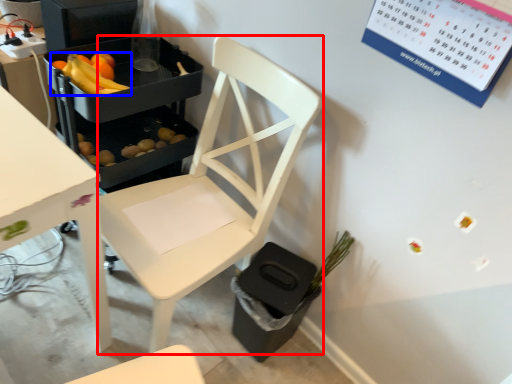
Question: Which object is further to the camera taking this photo, chair (highlighted by a red box) or banana (highlighted by a blue box)?

Choices:
 (A) chair
 (B) banana

Answer: (B)